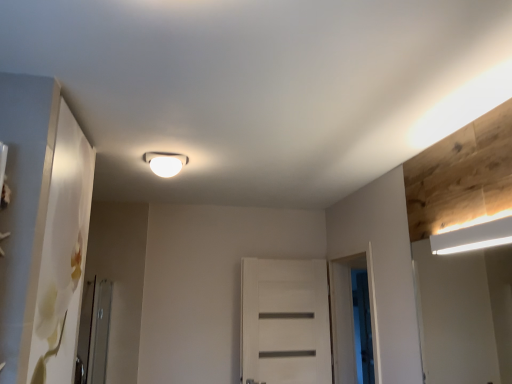
Locate an element on the screen. The width and height of the screenshot is (512, 384). white matte screen door at center, marked as the 2th screen door in a left-to-right arrangement is located at coordinates (350, 315).

This screenshot has width=512, height=384. What do you see at coordinates (285, 322) in the screenshot?
I see `white matte door at center` at bounding box center [285, 322].

The image size is (512, 384). What do you see at coordinates (362, 327) in the screenshot?
I see `transparent glass screen door at center-right, the third screen door viewed from the left` at bounding box center [362, 327].

Where is `white glossy light fixture at center, the second lamp viewed from the front`? The height and width of the screenshot is (384, 512). white glossy light fixture at center, the second lamp viewed from the front is located at coordinates (165, 163).

Based on the photo, which point is more distant from viewer, [323,273] or [179,159]?

The point [323,273] is farther.

Does white matte door at center contain white glossy light fixture at center, the second lamp viewed from the front?

No, white glossy light fixture at center, the second lamp viewed from the front, is not inside white matte door at center.

From the image's perspective, is white matte door at center above white glossy light fixture at center, which is the first lamp in back-to-front order?

No.

Which is nearer, (92,287) or (362,337)?

The point (92,287) is in front.

Which is more to the left, clear glass screen door at lower left, the first screen door positioned from the front, or transparent glass screen door at center-right, the third screen door viewed from the left?

Positioned to the left is clear glass screen door at lower left, the first screen door positioned from the front.

Is clear glass screen door at lower left, placed as the first screen door when sorted from left to right, touching transparent glass screen door at center-right, the third screen door viewed from the left?

No, clear glass screen door at lower left, placed as the first screen door when sorted from left to right, is not with transparent glass screen door at center-right, the third screen door viewed from the left.

From the picture: What's the angular difference between white matte rectangular light fixture at upper right, marked as the second lamp in a top-to-bottom arrangement, and transparent glass screen door at center-right, the third screen door viewed from the left,'s facing directions?

The angular difference between white matte rectangular light fixture at upper right, marked as the second lamp in a top-to-bottom arrangement, and transparent glass screen door at center-right, the third screen door viewed from the left, is 27 degrees.

Is white matte rectangular light fixture at upper right, marked as the second lamp in a top-to-bottom arrangement, positioned behind transparent glass screen door at center-right, the third screen door viewed from the left?

No, white matte rectangular light fixture at upper right, marked as the second lamp in a top-to-bottom arrangement, is closer to the viewer.

Is white matte rectangular light fixture at upper right, positioned as the second lamp in back-to-front order, taller than transparent glass screen door at center-right, the 3th screen door positioned from the front?

No.

Is white matte rectangular light fixture at upper right, the first lamp from the bottom, surrounding transparent glass screen door at center-right, placed as the first screen door when sorted from right to left?

No, transparent glass screen door at center-right, placed as the first screen door when sorted from right to left, is not a part of white matte rectangular light fixture at upper right, the first lamp from the bottom.

Is white matte door at center inside the boundaries of white matte rectangular light fixture at upper right, marked as the second lamp in a top-to-bottom arrangement, or outside?

white matte door at center cannot be found inside white matte rectangular light fixture at upper right, marked as the second lamp in a top-to-bottom arrangement.

Is white matte door at center in contact with white matte rectangular light fixture at upper right, positioned as the second lamp in back-to-front order?

No, white matte door at center is not beside white matte rectangular light fixture at upper right, positioned as the second lamp in back-to-front order.

From a real-world perspective, which is physically above, white matte door at center or white matte rectangular light fixture at upper right, which appears as the second lamp when viewed from the left?

From a 3D spatial view, white matte rectangular light fixture at upper right, which appears as the second lamp when viewed from the left, is above.

Does white matte door at center have a lesser width compared to white matte rectangular light fixture at upper right, the first lamp from the bottom?

No.

Which is less distant, (83,328) or (159,158)?

Point (83,328) is closer to the camera than point (159,158).

From a real-world perspective, is clear glass screen door at lower left, the first screen door positioned from the front, on white glossy light fixture at center, the 2th lamp from the bottom?

No.

How far apart are clear glass screen door at lower left, placed as the first screen door when sorted from left to right, and white glossy light fixture at center, which is the first lamp in back-to-front order?

clear glass screen door at lower left, placed as the first screen door when sorted from left to right, is 4.41 feet away from white glossy light fixture at center, which is the first lamp in back-to-front order.

Is clear glass screen door at lower left, the first screen door positioned from the front, next to white glossy light fixture at center, the second lamp viewed from the front?

No, clear glass screen door at lower left, the first screen door positioned from the front, is not touching white glossy light fixture at center, the second lamp viewed from the front.

Which of these two, white matte rectangular light fixture at upper right, the first lamp from the bottom, or clear glass screen door at lower left, which is the 3th screen door from right to left, stands taller?

Standing taller between the two is clear glass screen door at lower left, which is the 3th screen door from right to left.

Is white matte rectangular light fixture at upper right, the 1th lamp from the front, turned away from clear glass screen door at lower left, which is the 3th screen door from right to left?

No.

Is white matte rectangular light fixture at upper right, which is the first lamp in right-to-left order, surrounding clear glass screen door at lower left, placed as the first screen door when sorted from left to right?

No, clear glass screen door at lower left, placed as the first screen door when sorted from left to right, is not surrounded by white matte rectangular light fixture at upper right, which is the first lamp in right-to-left order.

Measure the distance between white matte rectangular light fixture at upper right, marked as the second lamp in a top-to-bottom arrangement, and clear glass screen door at lower left, which is the 3th screen door from right to left.

white matte rectangular light fixture at upper right, marked as the second lamp in a top-to-bottom arrangement, and clear glass screen door at lower left, which is the 3th screen door from right to left, are 8.09 feet apart.

Which of these two, transparent glass screen door at center-right, placed as the first screen door when sorted from right to left, or white matte rectangular light fixture at upper right, the 1th lamp from the front, is bigger?

With larger size is transparent glass screen door at center-right, placed as the first screen door when sorted from right to left.

Is transparent glass screen door at center-right, the 3th screen door positioned from the front, aimed at white matte rectangular light fixture at upper right, the first lamp from the bottom?

No.

Consider the image. Does transparent glass screen door at center-right, placed as the first screen door when sorted from right to left, appear on the left side of white matte rectangular light fixture at upper right, which is the first lamp in right-to-left order?

No, transparent glass screen door at center-right, placed as the first screen door when sorted from right to left, is not to the left of white matte rectangular light fixture at upper right, which is the first lamp in right-to-left order.

You are a GUI agent. You are given a task and a screenshot of the screen. Output one action in this format:
    pyautogui.click(x=<x>, y=<y>)
    Task: Click on the door located underneath the white glossy light fixture at center, which is the first lamp in back-to-front order (from a real-world perspective)
    The image size is (512, 384).
    Given the screenshot: What is the action you would take?
    pyautogui.click(x=285, y=322)

You are a GUI agent. You are given a task and a screenshot of the screen. Output one action in this format:
    pyautogui.click(x=<x>, y=<y>)
    Task: Click on the 1st screen door directly above the transparent glass screen door at center-right, positioned as the 1th screen door in back-to-front order (from a real-world perspective)
    This screenshot has height=384, width=512.
    Given the screenshot: What is the action you would take?
    pyautogui.click(x=94, y=332)

Estimate the real-world distances between objects in this image. Which object is closer to white matte screen door at center, marked as the 2th screen door in a left-to-right arrangement, transparent glass screen door at center-right, positioned as the 1th screen door in back-to-front order, or white glossy light fixture at center, marked as the 1th lamp in a left-to-right arrangement?

transparent glass screen door at center-right, positioned as the 1th screen door in back-to-front order.

When comparing their distances from transparent glass screen door at center-right, positioned as the 1th screen door in back-to-front order, does white matte rectangular light fixture at upper right, positioned as the second lamp in back-to-front order, or white matte door at center seem closer?

The object closer to transparent glass screen door at center-right, positioned as the 1th screen door in back-to-front order, is white matte door at center.

Based on their spatial positions, is clear glass screen door at lower left, placed as the first screen door when sorted from left to right, or white matte screen door at center, the 2th screen door when ordered from back to front, further from white glossy light fixture at center, which appears as the 2th lamp when viewed from the right?

Based on the image, white matte screen door at center, the 2th screen door when ordered from back to front, appears to be further to white glossy light fixture at center, which appears as the 2th lamp when viewed from the right.

Looking at the image, which one is located closer to clear glass screen door at lower left, the first screen door positioned from the front, white matte rectangular light fixture at upper right, the 1th lamp from the front, or transparent glass screen door at center-right, the third screen door viewed from the left?

transparent glass screen door at center-right, the third screen door viewed from the left, is closer to clear glass screen door at lower left, the first screen door positioned from the front.

When comparing their distances from transparent glass screen door at center-right, placed as the first screen door when sorted from right to left, does white glossy light fixture at center, the second lamp viewed from the front, or clear glass screen door at lower left, positioned as the third screen door in back-to-front order, seem further?

clear glass screen door at lower left, positioned as the third screen door in back-to-front order, lies further to transparent glass screen door at center-right, placed as the first screen door when sorted from right to left, than the other object.

Looking at the image, which one is located further to white glossy light fixture at center, the 2th lamp from the bottom, clear glass screen door at lower left, the first screen door positioned from the front, or transparent glass screen door at center-right, positioned as the 1th screen door in back-to-front order?

transparent glass screen door at center-right, positioned as the 1th screen door in back-to-front order, is positioned further to the anchor white glossy light fixture at center, the 2th lamp from the bottom.

Considering their positions, is transparent glass screen door at center-right, positioned as the 1th screen door in back-to-front order, positioned closer to white matte door at center than white matte rectangular light fixture at upper right, marked as the second lamp in a top-to-bottom arrangement?

Among the two, transparent glass screen door at center-right, positioned as the 1th screen door in back-to-front order, is located nearer to white matte door at center.

When comparing their distances from clear glass screen door at lower left, placed as the first screen door when sorted from left to right, does transparent glass screen door at center-right, the third screen door viewed from the left, or white matte door at center seem further?

Based on the image, transparent glass screen door at center-right, the third screen door viewed from the left, appears to be further to clear glass screen door at lower left, placed as the first screen door when sorted from left to right.

Find the location of `lamp between white matte rectangular light fixture at upper right, the 1th lamp from the front, and transparent glass screen door at center-right, positioned as the 1th screen door in back-to-front order, along the z-axis`. lamp between white matte rectangular light fixture at upper right, the 1th lamp from the front, and transparent glass screen door at center-right, positioned as the 1th screen door in back-to-front order, along the z-axis is located at coordinates (165, 163).

You are a GUI agent. You are given a task and a screenshot of the screen. Output one action in this format:
    pyautogui.click(x=<x>, y=<y>)
    Task: Click on the door between white matte screen door at center, the second screen door in the front-to-back sequence, and transparent glass screen door at center-right, positioned as the 1th screen door in back-to-front order, from front to back
    This screenshot has height=384, width=512.
    Given the screenshot: What is the action you would take?
    pyautogui.click(x=285, y=322)

I want to click on screen door located between clear glass screen door at lower left, positioned as the third screen door in back-to-front order, and transparent glass screen door at center-right, the 3th screen door positioned from the front, in the depth direction, so click(x=350, y=315).

Locate an element on the screen. door situated between clear glass screen door at lower left, the first screen door positioned from the front, and white matte screen door at center, positioned as the 2th screen door in right-to-left order, from left to right is located at coordinates (285, 322).